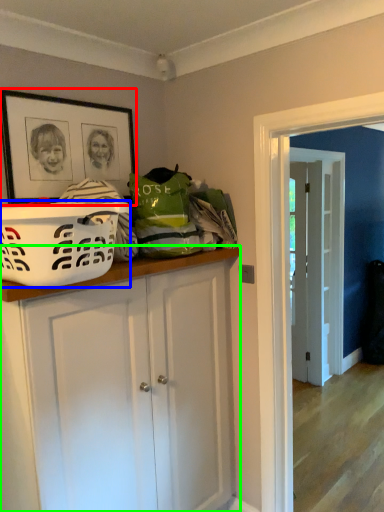
Question: Which is farther away from picture frame (highlighted by a red box)? basket (highlighted by a blue box) or cabinetry (highlighted by a green box)?

Choices:
 (A) basket
 (B) cabinetry

Answer: (B)